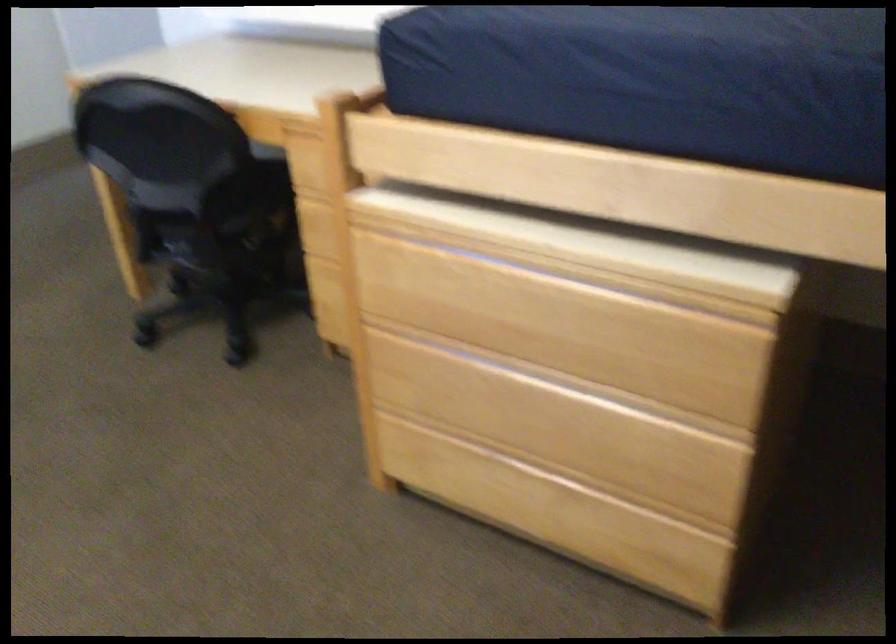
Question: Based on the continuous images, in which direction is the camera rotating? Reply with the corresponding letter.

Choices:
 (A) Left
 (B) Right
 (C) Up
 (D) Down

Answer: (A)